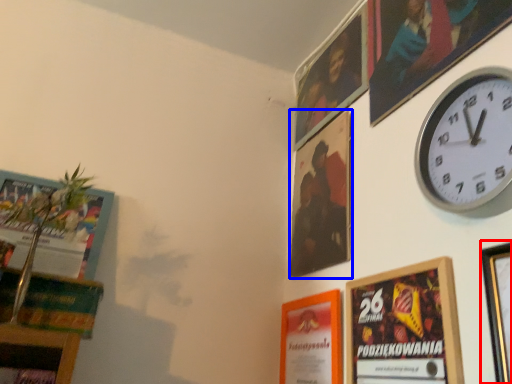
Question: Which of the following is the farthest to the observer, picture frame (highlighted by a red box) or picture frame (highlighted by a blue box)?

Choices:
 (A) picture frame
 (B) picture frame

Answer: (B)